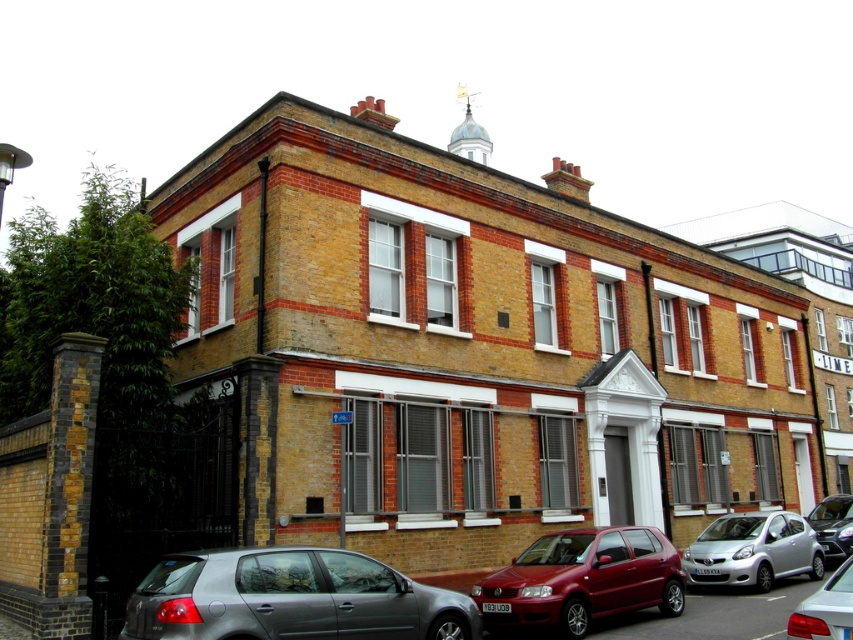
Question: Estimate the real-world distances between objects in this image. Which object is farther from the silver metallic sedan at center?

Choices:
 (A) silver metallic hatchback at center
 (B) silver metallic hatchback at lower right
 (C) silver metallic hatchback at lower left
 (D) metallic red hatchback at center

Answer: (C)

Question: Is silver metallic hatchback at lower left bigger than metallic red hatchback at center?

Choices:
 (A) no
 (B) yes

Answer: (A)

Question: Does silver metallic hatchback at lower left appear over silver metallic hatchback at lower right?

Choices:
 (A) no
 (B) yes

Answer: (B)

Question: Considering the real-world distances, which object is farthest from the silver metallic hatchback at center?

Choices:
 (A) silver metallic sedan at center
 (B) silver metallic hatchback at lower left
 (C) metallic red hatchback at center

Answer: (B)

Question: Is silver metallic hatchback at lower left further to camera compared to metallic red hatchback at center?

Choices:
 (A) no
 (B) yes

Answer: (A)

Question: Estimate the real-world distances between objects in this image. Which object is farther from the silver metallic hatchback at lower right?

Choices:
 (A) silver metallic hatchback at lower left
 (B) metallic red hatchback at center

Answer: (A)